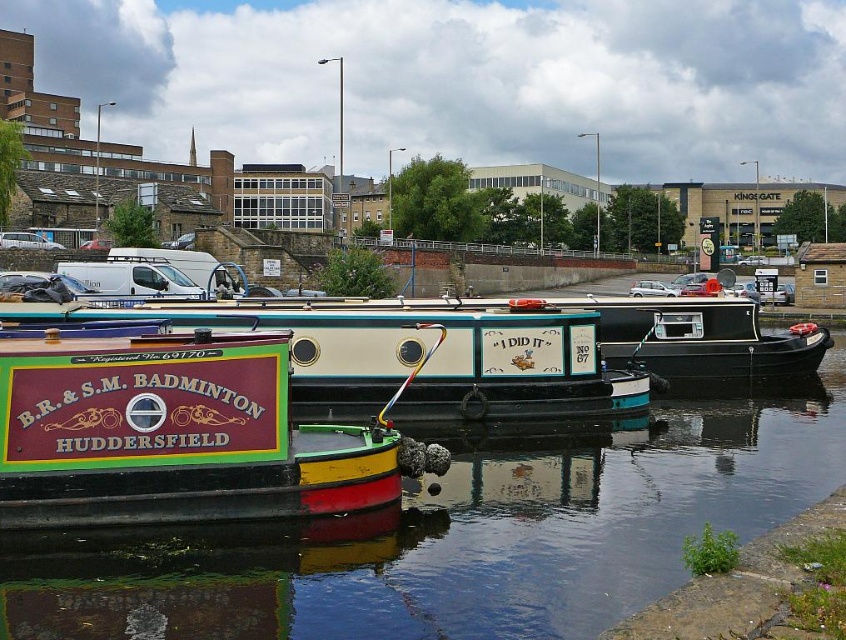
You are standing at the edge of the canal and see two points marked on the water. The first point is at coordinate (619, 483) and the second is at (158, 419). Which point is closer to you?

Point (158, 419) is closer to you because it is nearer to the camera compared to point (619, 483), which is further away.

You are a photographer standing at the edge of the canal. You want to capture both the maroon painted wood boat at lower left and the maroon painted wood boat at center in a single shot. Which boat should you focus on first to ensure both are in frame?

The maroon painted wood boat at lower left is located above the maroon painted wood boat at center. Therefore, to capture both in a single shot, you should focus on the maroon painted wood boat at lower left first as it is positioned higher up, allowing the lower boat to remain within the frame.